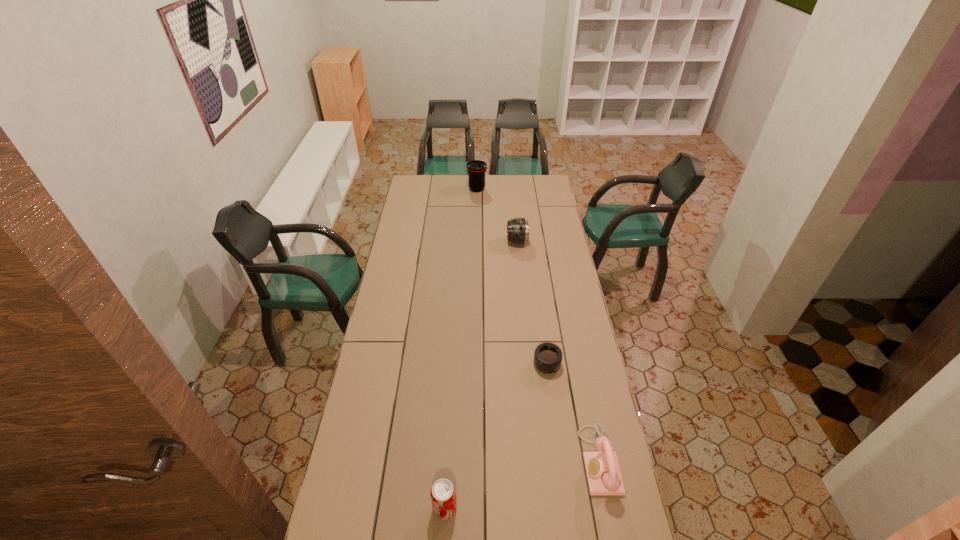
Locate an element on the screen. vacant position located 0.190m at the front element of the second farthest object is located at coordinates (472, 241).

Identify the location of free space located at the front element of the second farthest object. This screenshot has width=960, height=540. (x=470, y=241).

Where is `vacant space located on the dial of the rightmost object`? This screenshot has width=960, height=540. vacant space located on the dial of the rightmost object is located at coordinates (522, 460).

I want to click on free space located 0.250m on the dial of the rightmost object, so click(508, 460).

This screenshot has width=960, height=540. I want to click on free space located on the dial of the rightmost object, so click(490, 460).

The image size is (960, 540). Find the location of `free space located 0.110m on the right of the soda can`. free space located 0.110m on the right of the soda can is located at coordinates 492,508.

What are the coordinates of `free region located 0.200m on the side of the nearest telephoto lens with brand markings and control switches` in the screenshot? It's located at (555, 423).

Identify the location of object positioned at the far edge. (476, 169).

The image size is (960, 540). I want to click on telephone located in the right edge section of the desktop, so pos(603,473).

The height and width of the screenshot is (540, 960). I want to click on telephoto lens present at the right edge, so click(548, 357).